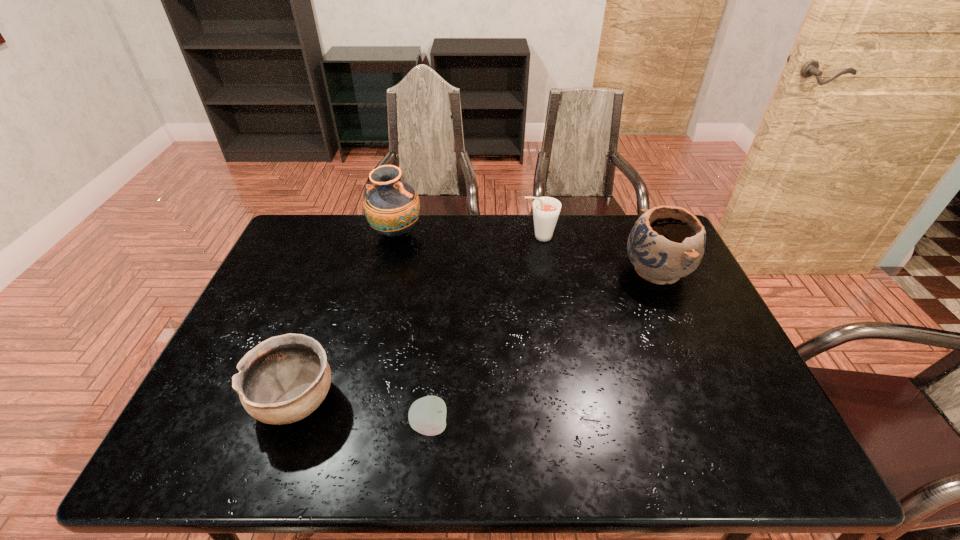
In order to click on the tallest pottery in this screenshot , I will do `click(392, 207)`.

Identify the location of the rightmost pottery. (666, 243).

You are a GUI agent. You are given a task and a screenshot of the screen. Output one action in this format:
    pyautogui.click(x=<x>, y=<y>)
    Task: Click on the second shortest pottery
    This screenshot has height=540, width=960.
    Given the screenshot: What is the action you would take?
    pyautogui.click(x=666, y=243)

Identify the location of the third shortest object. (546, 210).

Locate an element on the screen. This screenshot has height=540, width=960. root beer is located at coordinates (546, 210).

Identify the location of the nearest pottery. The height and width of the screenshot is (540, 960). (282, 380).

Locate an element on the screen. The width and height of the screenshot is (960, 540). the second shortest object is located at coordinates [x=282, y=380].

This screenshot has height=540, width=960. Find the location of `the third object from right to left`. the third object from right to left is located at coordinates (427, 415).

Identify the location of the shortest object. (427, 415).

What are the coordinates of `vacant space located on the left of the tallest pottery` in the screenshot? It's located at (328, 233).